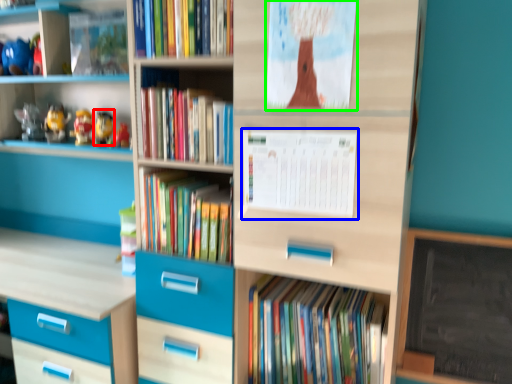
Question: Which object is positioned farthest from toy (highlighted by a red box)? Select from paperback book (highlighted by a blue box) and paperback book (highlighted by a green box).

Choices:
 (A) paperback book
 (B) paperback book

Answer: (B)